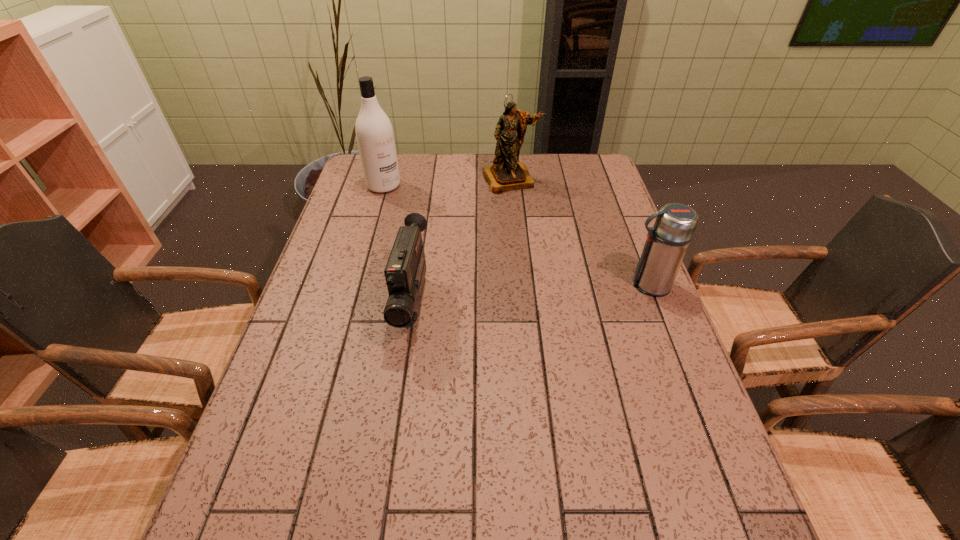
This screenshot has width=960, height=540. I want to click on object that is positioned at the left edge, so click(374, 132).

The height and width of the screenshot is (540, 960). In order to click on object situated at the right edge in this screenshot , I will do `click(667, 241)`.

At what (x,y) coordinates should I click in order to perform the action: click on object that is at the far left corner. Please return your answer as a coordinate pair (x, y). The image size is (960, 540). Looking at the image, I should click on (374, 132).

You are a GUI agent. You are given a task and a screenshot of the screen. Output one action in this format:
    pyautogui.click(x=<x>, y=<y>)
    Task: Click on the vacant space at the far edge
    
    Given the screenshot: What is the action you would take?
    pyautogui.click(x=457, y=178)

The width and height of the screenshot is (960, 540). What are the coordinates of `vacant area at the near edge of the desktop` in the screenshot? It's located at (436, 457).

Where is `vacant space at the left edge of the desktop`? Image resolution: width=960 pixels, height=540 pixels. vacant space at the left edge of the desktop is located at coordinates (309, 285).

In the image, there is a desktop. Where is `vacant space at the right edge`? This screenshot has height=540, width=960. vacant space at the right edge is located at coordinates (647, 332).

This screenshot has height=540, width=960. I want to click on blank space at the far right corner, so click(595, 163).

In the image, there is a desktop. Where is `free space at the near right corner`? This screenshot has height=540, width=960. free space at the near right corner is located at coordinates [694, 482].

Identify the location of free point between the shampoo and the rightmost object. Image resolution: width=960 pixels, height=540 pixels. (516, 235).